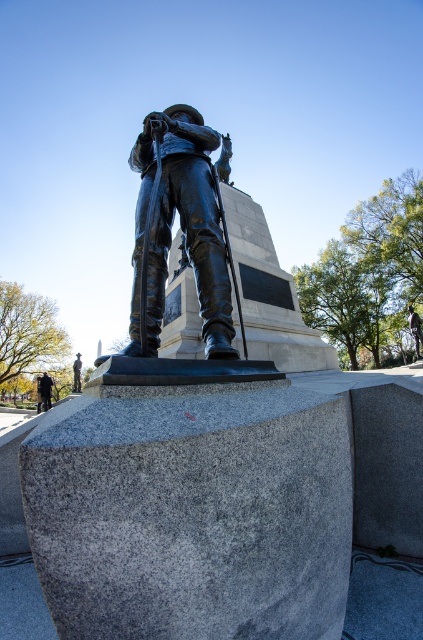
You are an art student sketching the bronze statue at center and the dark brown leather jacket at lower left. Which object should you draw first if you want to capture the taller one in your sketch?

The dark brown leather jacket at lower left is taller than the bronze statue at center, so you should draw the dark brown leather jacket at lower left first to capture the taller one.

You are standing in front of the statue and want to take a photo of the bronze statue at center. If your camera has a minimum focusing distance of 5 feet, will you be able to take a clear photo without moving closer?

The bronze statue at center is 7.02 feet away from the viewer, which is beyond the camera minimum focusing distance of 5 feet. Therefore, you can take a clear photo without moving closer.

You are a tour guide explaining the statue to visitors. You point out the bronze statue at center and the dark brown leather jacket at lower left. Which object is positioned higher in the image?

The bronze statue at center is located above the dark brown leather jacket at lower left, so it is positioned higher in the image.